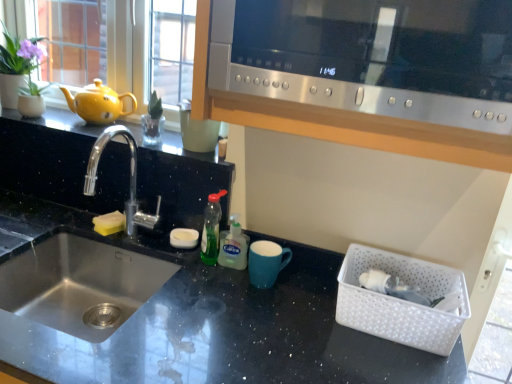
Where is `free location to the right of silver metallic faucet at left`? This screenshot has height=384, width=512. free location to the right of silver metallic faucet at left is located at coordinates (180, 256).